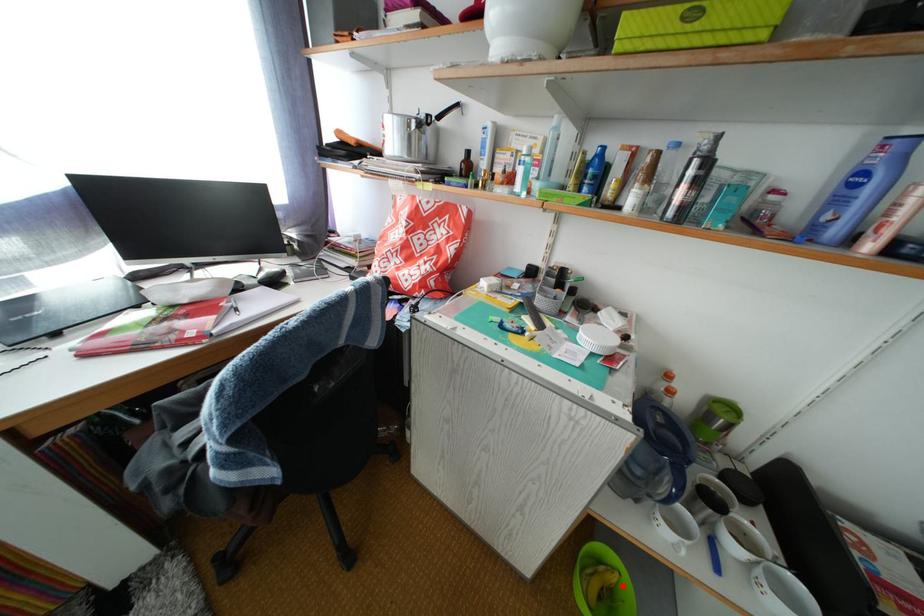
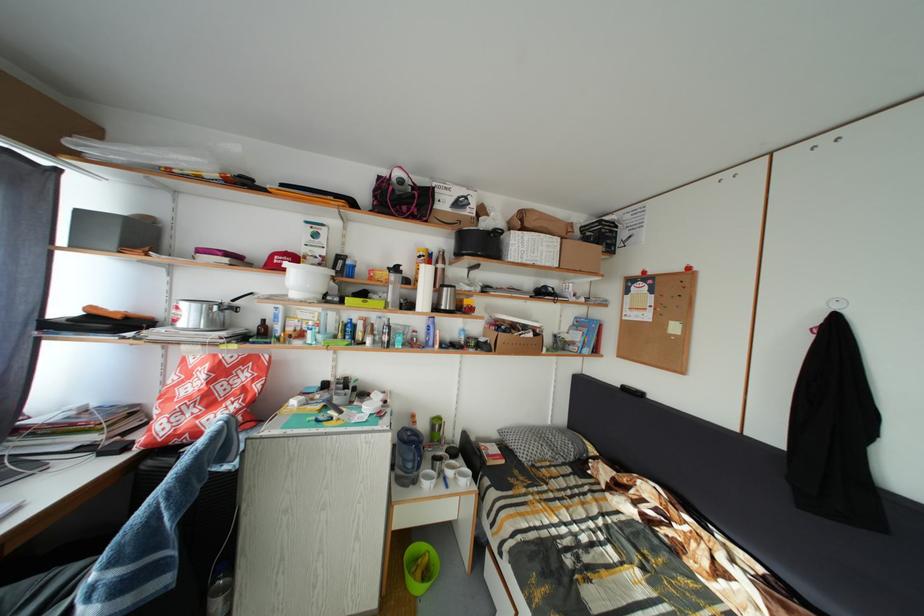
The point at the highlighted location is marked in the first image. Where is the corresponding point in the second image?

(435, 565)